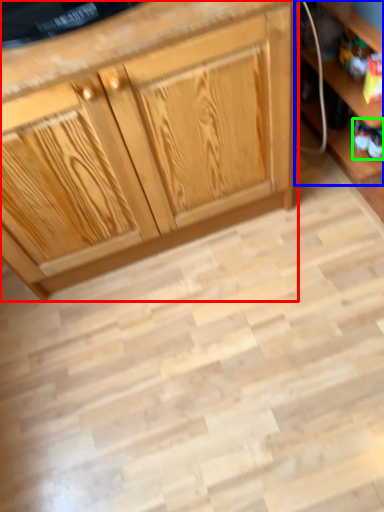
Question: Which object is positioned closest to cabinetry (highlighted by a red box)? Select from shelf (highlighted by a blue box) and toy (highlighted by a green box).

Choices:
 (A) shelf
 (B) toy

Answer: (A)